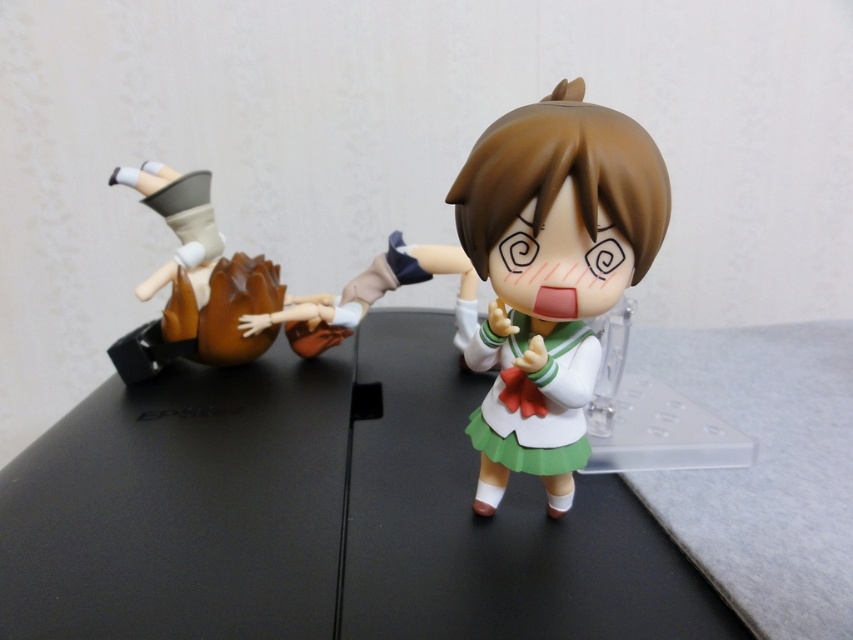
Who is more forward, (477, 218) or (212, 323)?

Point (477, 218) is more forward.

Between point (491, 125) and point (221, 362), which one is positioned in front?

Positioned in front is point (491, 125).

Where is `satin white doll at center`? satin white doll at center is located at coordinates (550, 273).

Can you confirm if black plastic table at center is thinner than brown matte/wooden figurine at left?

Incorrect, black plastic table at center's width is not less than brown matte/wooden figurine at left's.

Who is shorter, black plastic table at center or brown matte/wooden figurine at left?

Standing shorter between the two is black plastic table at center.

Describe the element at coordinates (321, 515) in the screenshot. I see `black plastic table at center` at that location.

The width and height of the screenshot is (853, 640). Find the location of `black plastic table at center`. black plastic table at center is located at coordinates (321, 515).

Is point (440, 397) closer to camera compared to point (490, 241)?

No, (440, 397) is behind (490, 241).

Is point (573, 524) more distant than point (497, 499)?

No.

You are a GUI agent. You are given a task and a screenshot of the screen. Output one action in this format:
    pyautogui.click(x=<x>, y=<y>)
    Task: Click on the black plastic table at center
    This screenshot has height=640, width=853.
    Given the screenshot: What is the action you would take?
    pyautogui.click(x=321, y=515)